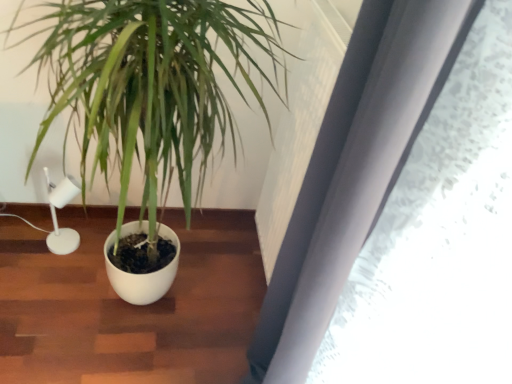
Question: In the image, is white matte lamp at left on the left side or the right side of green matte plant at center?

Choices:
 (A) left
 (B) right

Answer: (A)

Question: In terms of size, does white matte lamp at left appear bigger or smaller than green matte plant at center?

Choices:
 (A) small
 (B) big

Answer: (A)

Question: From the image's perspective, relative to green matte plant at center, is white matte lamp at left above or below?

Choices:
 (A) above
 (B) below

Answer: (B)

Question: From a real-world perspective, relative to white matte lamp at left, is green matte plant at center vertically above or below?

Choices:
 (A) above
 (B) below

Answer: (A)

Question: From the image's perspective, is green matte plant at center above or below white matte lamp at left?

Choices:
 (A) above
 (B) below

Answer: (A)

Question: In the image, is green matte plant at center positioned in front of or behind white matte lamp at left?

Choices:
 (A) front
 (B) behind

Answer: (A)

Question: Is point (108, 76) positioned closer to the camera than point (71, 241)?

Choices:
 (A) closer
 (B) farther

Answer: (A)